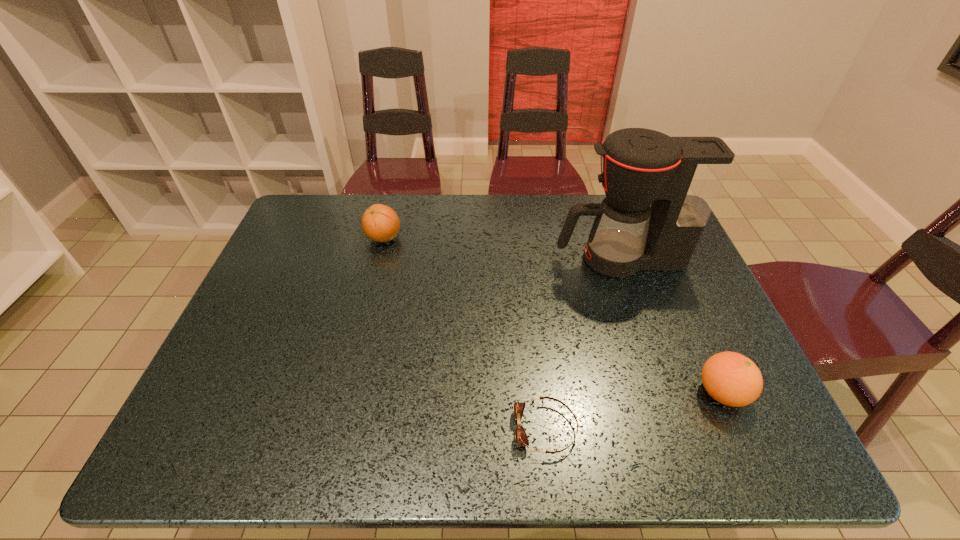
This screenshot has height=540, width=960. I want to click on vacant space at the far edge of the desktop, so coord(511,206).

Locate an element on the screen. blank area at the near edge is located at coordinates (642, 433).

Find the location of a particular element. Image resolution: width=960 pixels, height=540 pixels. vacant point at the left edge is located at coordinates (318, 278).

What are the coordinates of `blank area at the right edge` in the screenshot? It's located at (716, 315).

In the image, there is a desktop. Where is `vacant space at the near left corner`? This screenshot has height=540, width=960. vacant space at the near left corner is located at coordinates (252, 431).

This screenshot has height=540, width=960. In the image, there is a desktop. Identify the location of free region at the near right corner. [x=734, y=446].

Where is `free point between the coffee maker and the goggles`? free point between the coffee maker and the goggles is located at coordinates (583, 344).

Locate an element on the screen. vacant space that's between the coffee maker and the leftmost object is located at coordinates (501, 248).

I want to click on free spot between the tallest object and the nearer orange, so click(x=670, y=326).

In order to click on vacant space in between the right orange and the farther orange in this screenshot , I will do `click(553, 315)`.